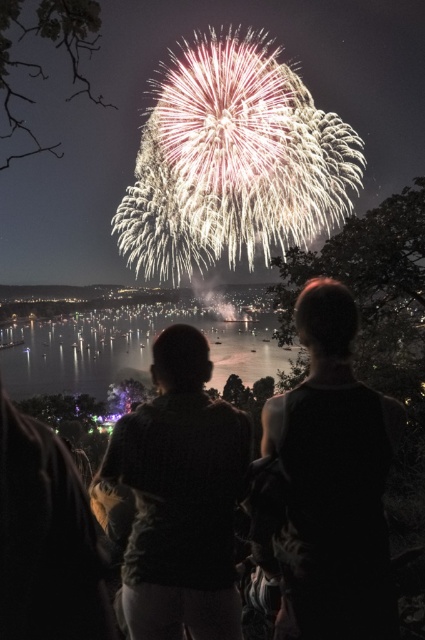
In the scene shown: You are a photographer trying to capture the fireworks display. You notice the dark textured shirt at center and the silvery reflective water at center in your frame. Which object appears narrower in your photo?

The dark textured shirt at center appears narrower than the silvery reflective water at center in the photo.